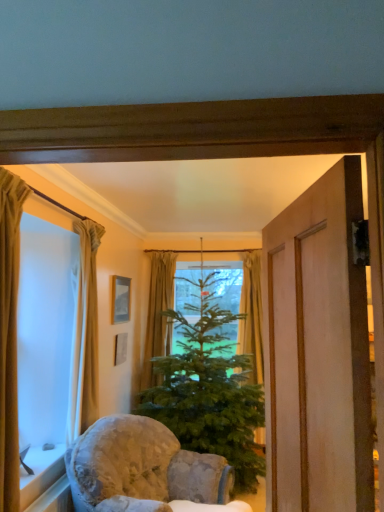
Question: Which direction should I rotate to look at green fabric curtain at center, the 1th curtain viewed from the back, — up or down?

Choices:
 (A) up
 (B) down

Answer: (B)

Question: Is wooden picture frame at center, marked as the 1th picture frame in a top-to-bottom arrangement, taller than beige fabric curtain at left, marked as the 2th curtain in a front-to-back arrangement?

Choices:
 (A) yes
 (B) no

Answer: (B)

Question: Is wooden picture frame at center, marked as the 1th picture frame in a top-to-bottom arrangement, bigger than beige fabric curtain at left, which ranks as the third curtain in back-to-front order?

Choices:
 (A) no
 (B) yes

Answer: (A)

Question: Could you tell me if wooden picture frame at center, marked as the 1th picture frame in a top-to-bottom arrangement, is facing beige fabric curtain at left, placed as the third curtain when sorted from right to left?

Choices:
 (A) no
 (B) yes

Answer: (A)

Question: Is beige fabric curtain at left, which ranks as the third curtain in back-to-front order, surrounded by wooden picture frame at center, marked as the 1th picture frame in a top-to-bottom arrangement?

Choices:
 (A) yes
 (B) no

Answer: (B)

Question: Is wooden picture frame at center, marked as the 1th picture frame in a top-to-bottom arrangement, placed right next to beige fabric curtain at left, placed as the third curtain when sorted from right to left?

Choices:
 (A) yes
 (B) no

Answer: (B)

Question: Is beige fabric curtain at left, marked as the 2th curtain in a front-to-back arrangement, at the back of wooden picture frame at center, marked as the 1th picture frame in a top-to-bottom arrangement?

Choices:
 (A) yes
 (B) no

Answer: (B)

Question: From a real-world perspective, does fluffy fabric chair at lower center stand above green matte christmas tree at center?

Choices:
 (A) yes
 (B) no

Answer: (B)

Question: Is fluffy fabric chair at lower center placed right next to green matte christmas tree at center?

Choices:
 (A) yes
 (B) no

Answer: (B)

Question: From the image's perspective, is fluffy fabric chair at lower center below green matte christmas tree at center?

Choices:
 (A) yes
 (B) no

Answer: (A)

Question: Considering the relative sizes of fluffy fabric chair at lower center and green matte christmas tree at center in the image provided, is fluffy fabric chair at lower center smaller than green matte christmas tree at center?

Choices:
 (A) no
 (B) yes

Answer: (B)

Question: Could you tell me if fluffy fabric chair at lower center is turned towards green matte christmas tree at center?

Choices:
 (A) yes
 (B) no

Answer: (B)

Question: Is fluffy fabric chair at lower center at the left side of green matte christmas tree at center?

Choices:
 (A) no
 (B) yes

Answer: (B)

Question: Would you say green matte christmas tree at center is part of beige fabric curtain at left, the fourth curtain from the right,'s contents?

Choices:
 (A) no
 (B) yes

Answer: (A)